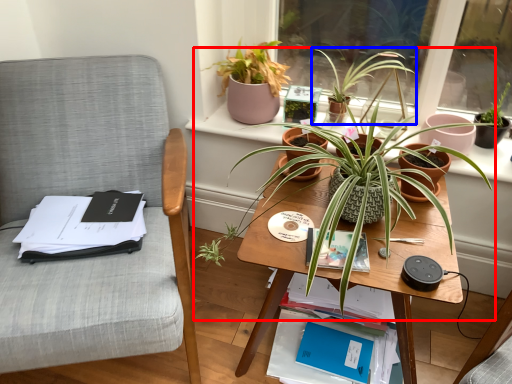
Question: Which object is further to the camera taking this photo, houseplant (highlighted by a red box) or houseplant (highlighted by a blue box)?

Choices:
 (A) houseplant
 (B) houseplant

Answer: (B)